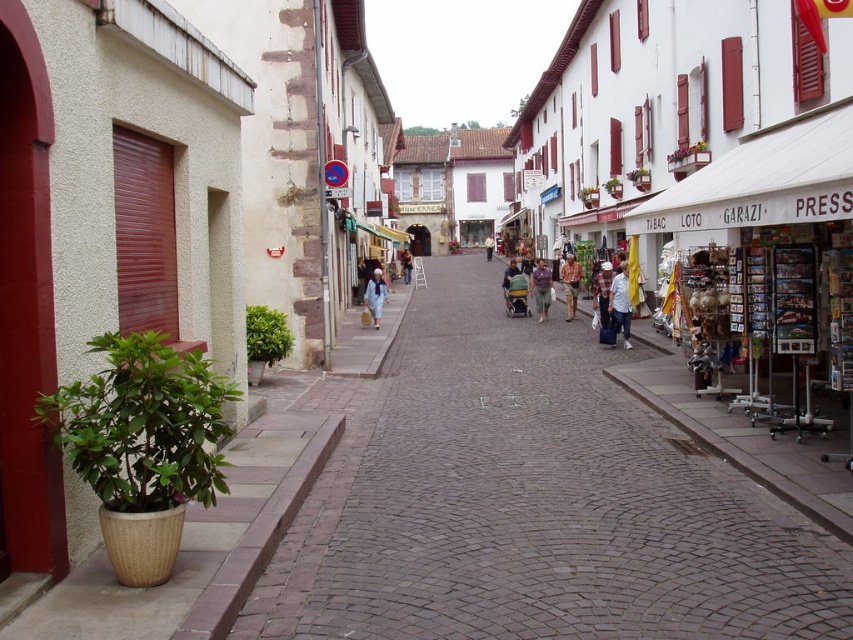
Question: Where is light blue denim jeans at center located in relation to light blue fabric jacket at center in the image?

Choices:
 (A) above
 (B) below

Answer: (B)

Question: Among these objects, which one is farthest from the camera?

Choices:
 (A) light blue fabric jacket at center
 (B) matte blue coat at center
 (C) blue denim jacket at center

Answer: (A)

Question: Which point is closer to the camera taking this photo?

Choices:
 (A) (378, 324)
 (B) (490, 253)

Answer: (A)

Question: Is light blue denim jeans at center thinner than matte blue coat at center?

Choices:
 (A) yes
 (B) no

Answer: (A)

Question: Can you confirm if cobblestone street at center is positioned below matte blue coat at center?

Choices:
 (A) yes
 (B) no

Answer: (A)

Question: Estimate the real-world distances between objects in this image. Which object is closer to the cobblestone street at center?

Choices:
 (A) plaid shirt at center
 (B) matte green stroller at center
 (C) blue fabric bag at center
 (D) light blue fabric jacket at center

Answer: (A)